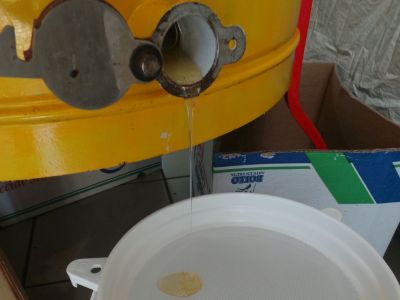
I want to click on box, so click(298, 180), click(280, 260).